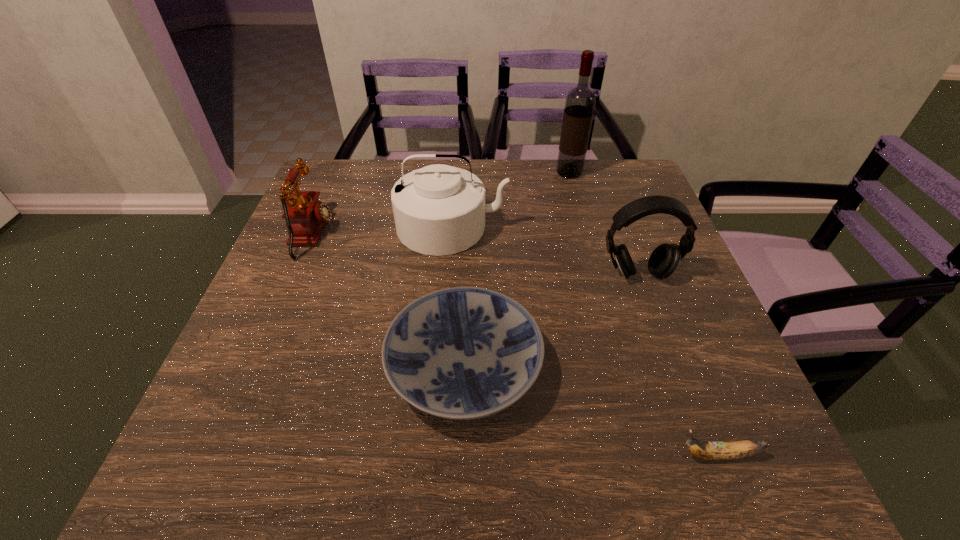
This screenshot has width=960, height=540. I want to click on free space that satisfies the following two spatial constraints: 1. on the spout of the second nearest object; 2. on the right side of the kettle, so click(x=443, y=367).

Find the location of `vacant space that satisfies the following two spatial constraints: 1. on the back side of the plate; 2. on the dial of the leftmost object`. vacant space that satisfies the following two spatial constraints: 1. on the back side of the plate; 2. on the dial of the leftmost object is located at coordinates (468, 235).

The height and width of the screenshot is (540, 960). Find the location of `vacant space that satisfies the following two spatial constraints: 1. on the front side of the wine bottle; 2. on the dial of the leftmost object`. vacant space that satisfies the following two spatial constraints: 1. on the front side of the wine bottle; 2. on the dial of the leftmost object is located at coordinates coord(586,235).